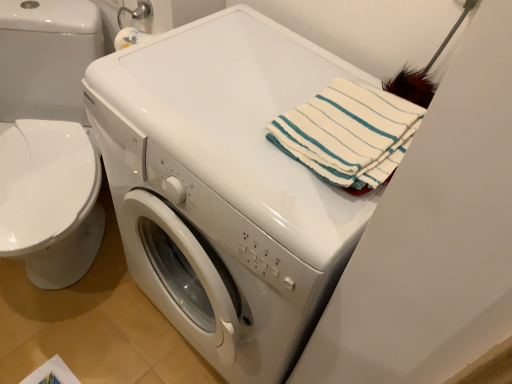
The image size is (512, 384). Find the location of `free spot behind white striped towel at upper right`. free spot behind white striped towel at upper right is located at coordinates (305, 66).